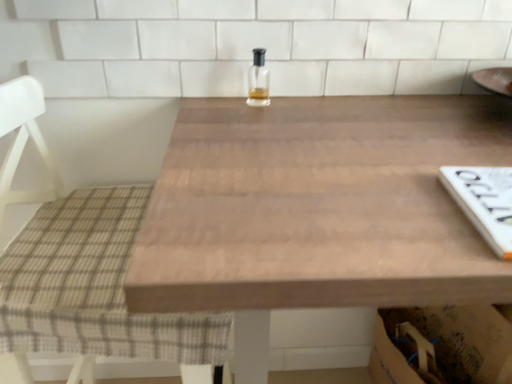
Question: Does clear glass bottle at center have a lesser height compared to wooden table at center?

Choices:
 (A) yes
 (B) no

Answer: (A)

Question: From a real-world perspective, is clear glass bottle at center physically below wooden table at center?

Choices:
 (A) no
 (B) yes

Answer: (A)

Question: From the image's perspective, does clear glass bottle at center appear higher than wooden table at center?

Choices:
 (A) no
 (B) yes

Answer: (B)

Question: Considering the relative sizes of clear glass bottle at center and wooden table at center in the image provided, is clear glass bottle at center thinner than wooden table at center?

Choices:
 (A) yes
 (B) no

Answer: (A)

Question: Is wooden table at center completely or partially inside clear glass bottle at center?

Choices:
 (A) no
 (B) yes

Answer: (A)

Question: From a real-world perspective, is clear glass bottle at center physically located above or below wooden table at center?

Choices:
 (A) below
 (B) above

Answer: (B)

Question: Is clear glass bottle at center spatially inside wooden table at center, or outside of it?

Choices:
 (A) inside
 (B) outside

Answer: (B)

Question: Relative to wooden table at center, is clear glass bottle at center in front or behind?

Choices:
 (A) front
 (B) behind

Answer: (B)

Question: Looking at the image, does clear glass bottle at center seem bigger or smaller compared to wooden table at center?

Choices:
 (A) big
 (B) small

Answer: (B)

Question: Is wooden table at center wider or thinner than clear glass bottle at center?

Choices:
 (A) wide
 (B) thin

Answer: (A)

Question: Is wooden table at center inside the boundaries of clear glass bottle at center, or outside?

Choices:
 (A) inside
 (B) outside

Answer: (B)

Question: Visually, is wooden table at center positioned to the left or to the right of clear glass bottle at center?

Choices:
 (A) left
 (B) right

Answer: (B)

Question: From the image's perspective, is wooden table at center positioned above or below clear glass bottle at center?

Choices:
 (A) above
 (B) below

Answer: (B)

Question: Considering the positions of plaid fabric chair at left and wooden table at center in the image, is plaid fabric chair at left taller or shorter than wooden table at center?

Choices:
 (A) short
 (B) tall

Answer: (B)

Question: Based on their sizes in the image, would you say plaid fabric chair at left is bigger or smaller than wooden table at center?

Choices:
 (A) small
 (B) big

Answer: (A)